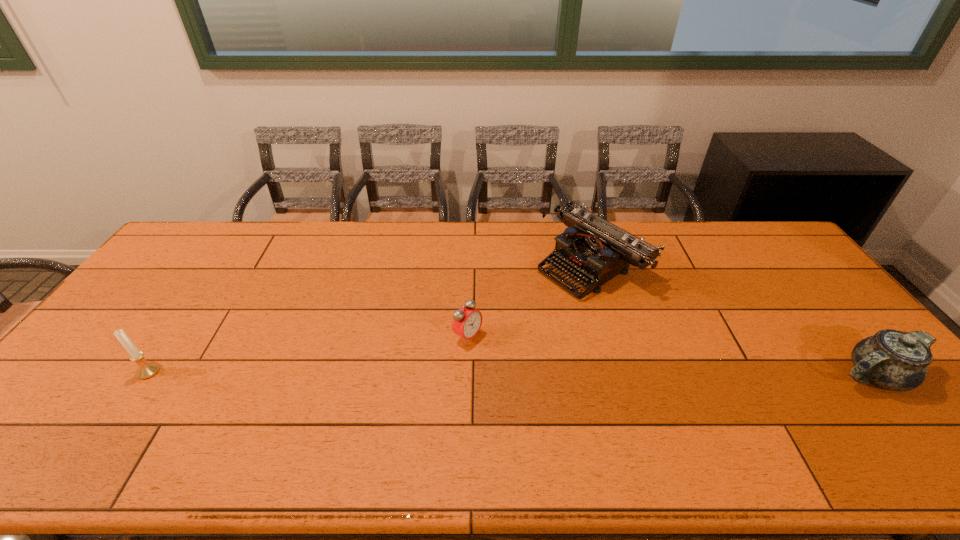
Locate an element on the screen. free point between the typewriter and the candle holder is located at coordinates pyautogui.click(x=370, y=318).

Find the location of `free space between the second object from right to left and the third nearest object`. free space between the second object from right to left and the third nearest object is located at coordinates pyautogui.click(x=529, y=301).

Locate an element on the screen. free space that is in between the alarm clock and the farthest object is located at coordinates (529, 301).

Identify the location of vacant area between the rightmost object and the second farthest object. (671, 356).

Identify the location of free space between the shortest object and the farthest object. This screenshot has width=960, height=540. (529, 301).

Find the location of a particular element. unoccupied position between the third nearest object and the typewriter is located at coordinates (529, 301).

Identify which object is the nearest to the rightmost object. Please provide its 2D coordinates. Your answer should be formatted as a tuple, i.e. [(x, y)], where the tuple contains the x and y coordinates of a point satisfying the conditions above.

[(594, 249)]

Identify which object is the third closest to the leftmost object. Please provide its 2D coordinates. Your answer should be formatted as a tuple, i.e. [(x, y)], where the tuple contains the x and y coordinates of a point satisfying the conditions above.

[(894, 360)]

This screenshot has height=540, width=960. I want to click on vacant space that satisfies the following two spatial constraints: 1. on the front side of the rightmost object; 2. from the spout of the typewriter, so click(623, 375).

Locate an element on the screen. The width and height of the screenshot is (960, 540). free region that satisfies the following two spatial constraints: 1. on the back side of the typewriter; 2. on the right side of the third object from right to left is located at coordinates (469, 265).